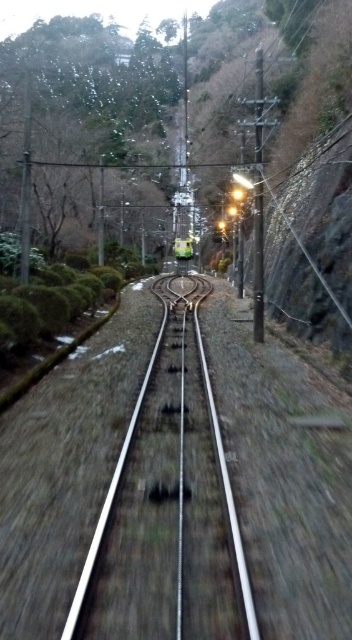
Question: Which point is farther to the camera?

Choices:
 (A) metallic green train at center
 (B) metallic silver train track at center

Answer: (A)

Question: Can you confirm if metallic silver train track at center is positioned below metallic green train at center?

Choices:
 (A) yes
 (B) no

Answer: (A)

Question: Which point is closer to the camera?

Choices:
 (A) (177, 422)
 (B) (181, 252)

Answer: (A)

Question: Where is metallic silver train track at center located in relation to metallic green train at center in the image?

Choices:
 (A) right
 (B) left

Answer: (B)

Question: Can you confirm if metallic silver train track at center is bigger than metallic green train at center?

Choices:
 (A) yes
 (B) no

Answer: (B)